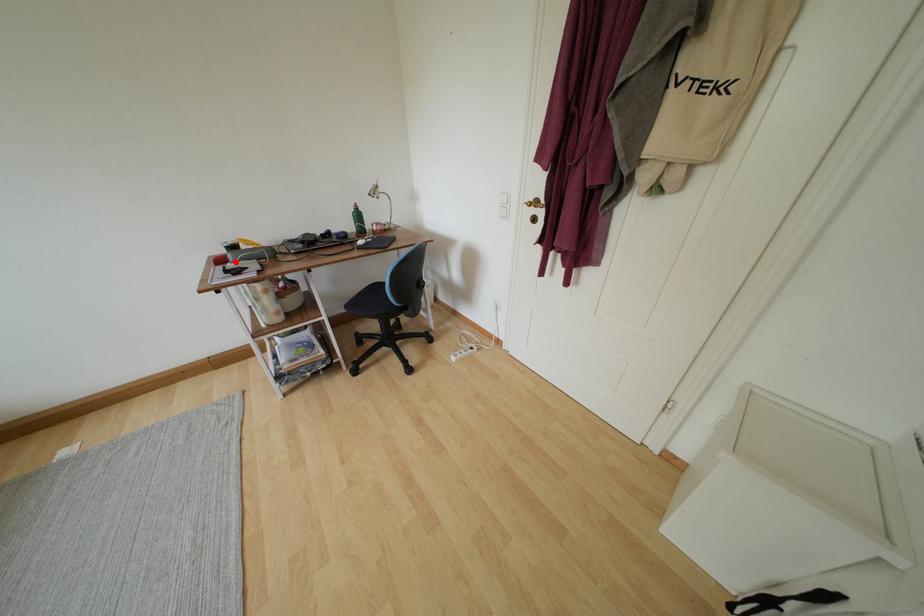
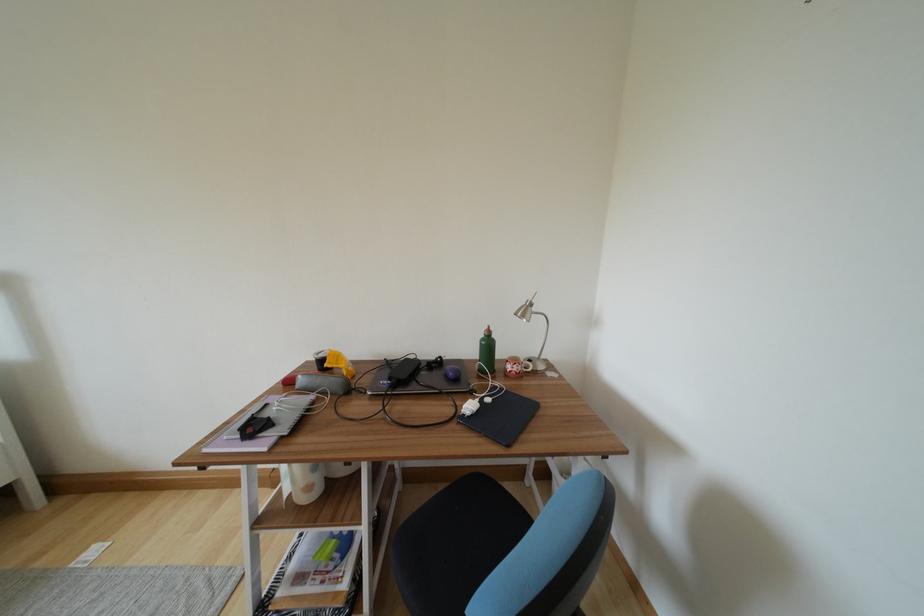
In the second image, find the point that corresponds to the highlighted location in the first image.

(306, 385)